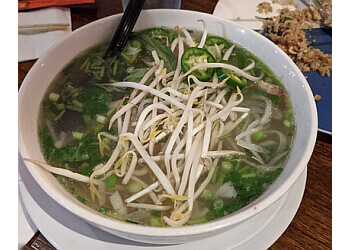
Identify the location of table. (326, 214).